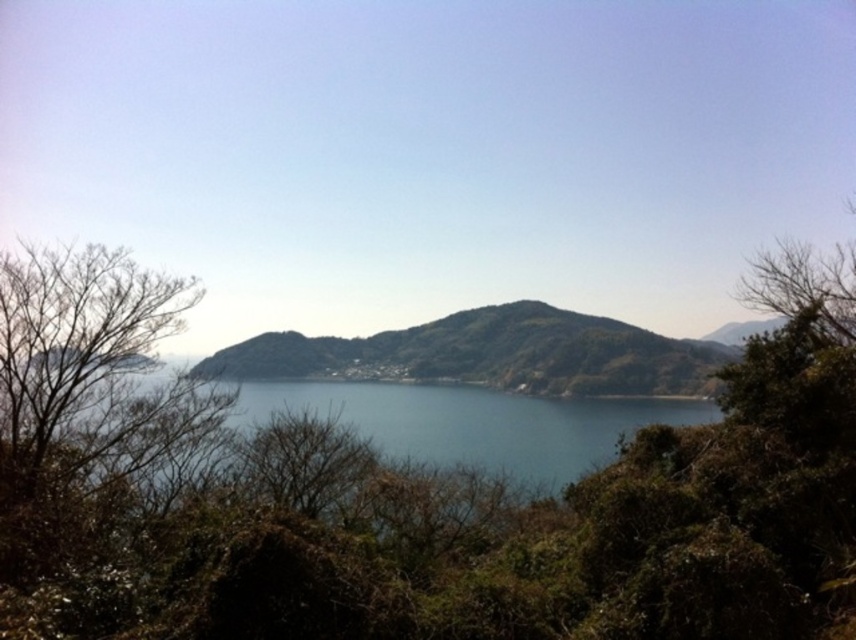
Question: Which point is closer to the camera taking this photo?

Choices:
 (A) (468, 440)
 (B) (235, 362)

Answer: (A)

Question: Is green grassy hill at center smaller than blue water at center?

Choices:
 (A) no
 (B) yes

Answer: (A)

Question: Which of the following is the closest to the observer?

Choices:
 (A) (609, 429)
 (B) (565, 582)
 (C) (337, 365)

Answer: (B)

Question: From the image, what is the correct spatial relationship of green grassy hill at center in relation to blue water at center?

Choices:
 (A) right
 (B) left

Answer: (A)

Question: Does green leafy tree at center come in front of blue water at center?

Choices:
 (A) no
 (B) yes

Answer: (B)

Question: Which of the following is the closest to the observer?

Choices:
 (A) green grassy hill at center
 (B) blue water at center
 (C) green leafy tree at center

Answer: (C)